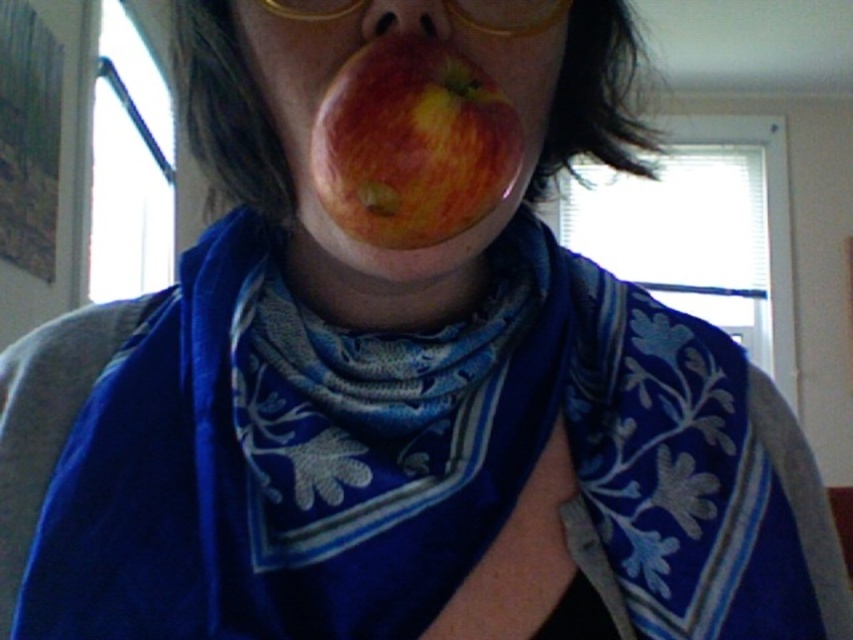
Question: Which object appears closest to the camera in this image?

Choices:
 (A) matte plastic nose at center
 (B) red matte apple at center

Answer: (B)

Question: Which of the following is the farthest from the observer?

Choices:
 (A) red matte apple at center
 (B) matte plastic nose at center
 (C) gold plastic glasses at upper center

Answer: (C)

Question: Does shiny red apple at center have a lesser width compared to gold plastic glasses at upper center?

Choices:
 (A) yes
 (B) no

Answer: (B)

Question: Among these points, which one is nearest to the camera?

Choices:
 (A) (331, 1)
 (B) (430, 32)

Answer: (B)

Question: Is red matte apple at center to the right of gold plastic glasses at upper center from the viewer's perspective?

Choices:
 (A) yes
 (B) no

Answer: (B)

Question: Does gold plastic glasses at upper center appear under matte plastic nose at center?

Choices:
 (A) yes
 (B) no

Answer: (B)